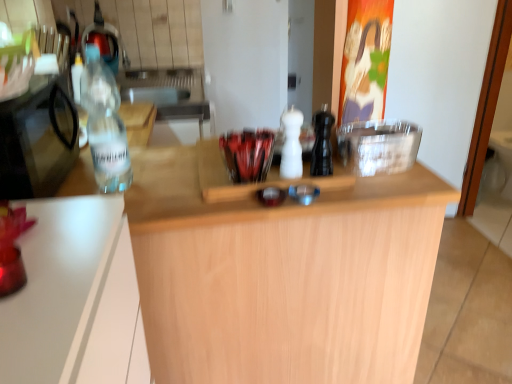
Find the location of a particular element. free spot behind clear glass bottle at left, the 3th bottle positioned from the right is located at coordinates (153, 158).